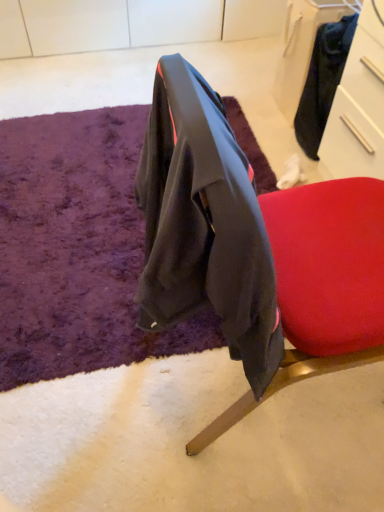
Question: Is black fabric drawer at upper right in front of velvet-like black jacket at center?

Choices:
 (A) yes
 (B) no

Answer: (B)

Question: Could you tell me if black fabric drawer at upper right is turned towards velvet-like black jacket at center?

Choices:
 (A) no
 (B) yes

Answer: (A)

Question: Is black fabric drawer at upper right at the right side of velvet-like black jacket at center?

Choices:
 (A) no
 (B) yes

Answer: (B)

Question: Does black fabric drawer at upper right have a smaller size compared to velvet-like black jacket at center?

Choices:
 (A) yes
 (B) no

Answer: (A)

Question: Can you confirm if black fabric drawer at upper right is wider than velvet-like black jacket at center?

Choices:
 (A) yes
 (B) no

Answer: (B)

Question: From the image's perspective, is velvet-like black jacket at center positioned above or below black fabric drawer at upper right?

Choices:
 (A) below
 (B) above

Answer: (A)

Question: Is velvet-like black jacket at center situated inside black fabric drawer at upper right or outside?

Choices:
 (A) inside
 (B) outside

Answer: (B)

Question: Based on their positions, is velvet-like black jacket at center located to the left or right of black fabric drawer at upper right?

Choices:
 (A) right
 (B) left

Answer: (B)

Question: From a real-world perspective, is velvet-like black jacket at center positioned above or below black fabric drawer at upper right?

Choices:
 (A) below
 (B) above

Answer: (B)

Question: In terms of height, does purple shaggy rug at center look taller or shorter compared to black fabric drawer at upper right?

Choices:
 (A) short
 (B) tall

Answer: (A)

Question: Would you say purple shaggy rug at center is inside or outside black fabric drawer at upper right?

Choices:
 (A) inside
 (B) outside

Answer: (B)

Question: Looking at their shapes, would you say purple shaggy rug at center is wider or thinner than black fabric drawer at upper right?

Choices:
 (A) thin
 (B) wide

Answer: (B)

Question: Is point (115, 128) closer or farther from the camera than point (352, 56)?

Choices:
 (A) closer
 (B) farther

Answer: (B)

Question: From the image's perspective, is velvet-like black jacket at center located above or below purple shaggy rug at center?

Choices:
 (A) above
 (B) below

Answer: (B)

Question: Visually, is velvet-like black jacket at center positioned to the left or to the right of purple shaggy rug at center?

Choices:
 (A) right
 (B) left

Answer: (A)